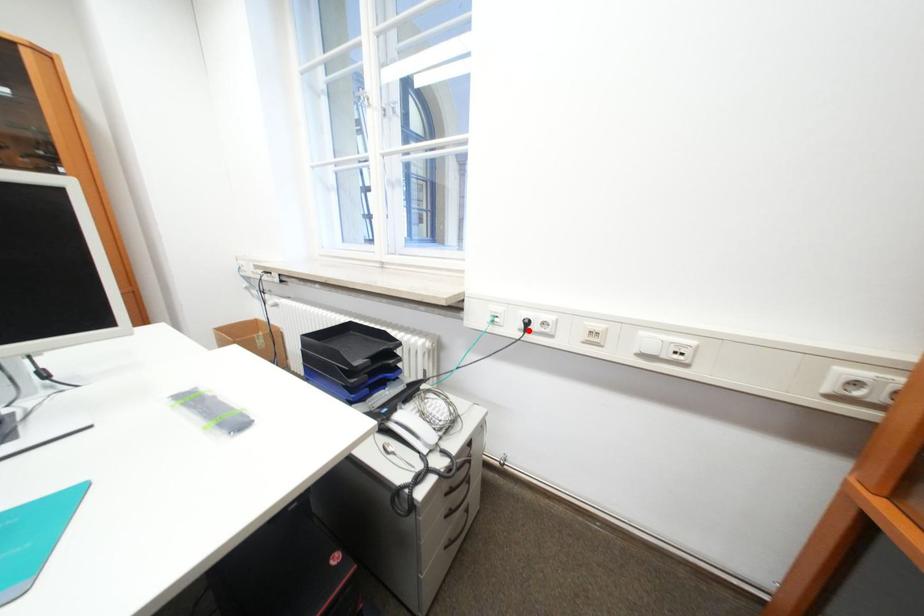
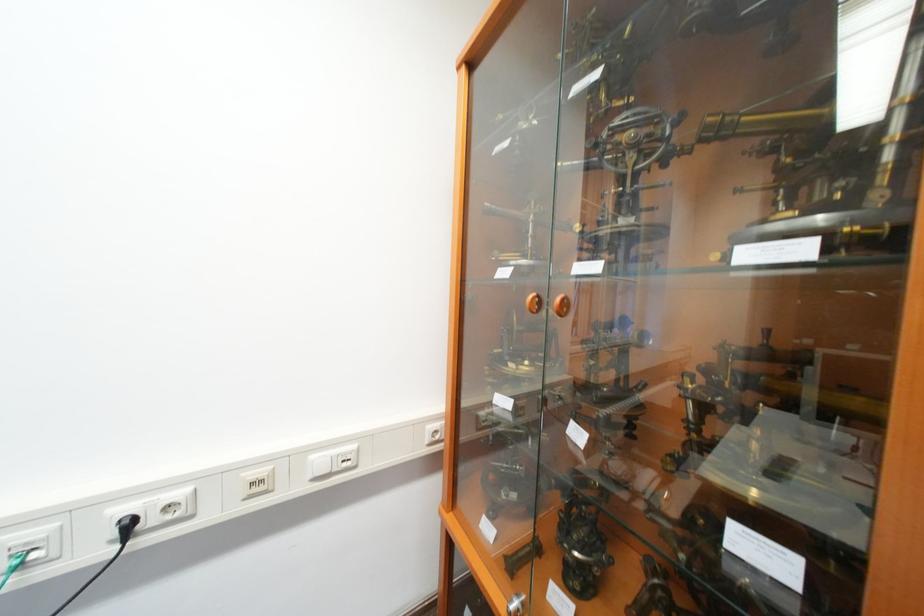
Find the pixel in the second image that matches the highlighted location in the first image.

(120, 543)